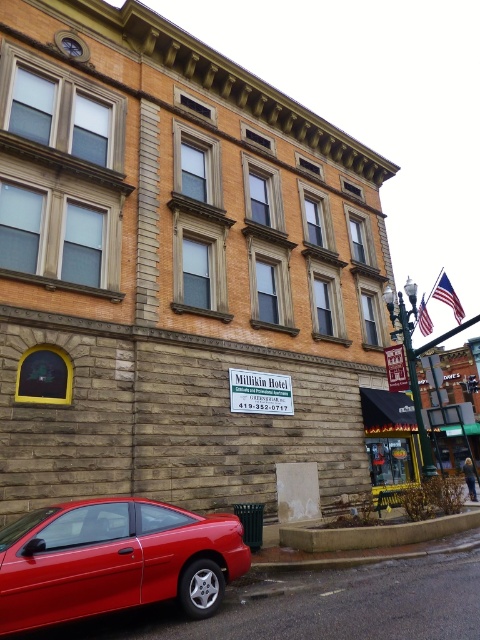
Question: Does matte red car at lower left appear over metallic gold street sign at center?

Choices:
 (A) yes
 (B) no

Answer: (B)

Question: Which of the following is the closest to the observer?

Choices:
 (A) (408, 282)
 (B) (24, 518)

Answer: (B)

Question: Which point is closer to the camera?

Choices:
 (A) (411, 282)
 (B) (119, 552)

Answer: (B)

Question: Can you confirm if matte red car at lower left is bigger than metallic gold street sign at center?

Choices:
 (A) yes
 (B) no

Answer: (B)

Question: Is matte red car at lower left bigger than metallic gold street sign at center?

Choices:
 (A) yes
 (B) no

Answer: (B)